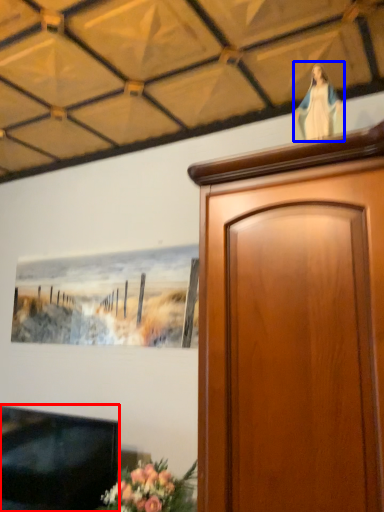
Question: Which object appears farthest to the camera in this image, television (highlighted by a red box) or woman (highlighted by a blue box)?

Choices:
 (A) television
 (B) woman

Answer: (A)